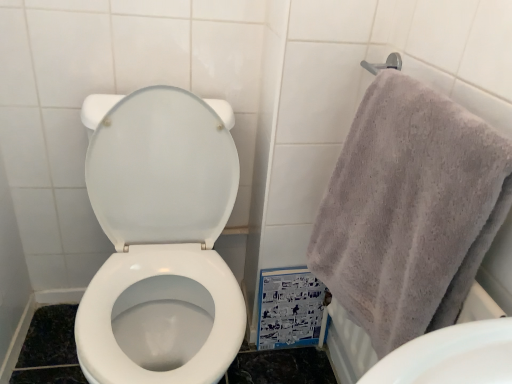
Question: Can you confirm if white glossy toilet at center is smaller than gray cotton towel at upper right?

Choices:
 (A) yes
 (B) no

Answer: (B)

Question: Does white glossy toilet at center appear on the left side of gray cotton towel at upper right?

Choices:
 (A) yes
 (B) no

Answer: (A)

Question: Is white glossy toilet at center looking in the opposite direction of gray cotton towel at upper right?

Choices:
 (A) no
 (B) yes

Answer: (A)

Question: Considering the relative sizes of white glossy toilet at center and gray cotton towel at upper right in the image provided, is white glossy toilet at center thinner than gray cotton towel at upper right?

Choices:
 (A) yes
 (B) no

Answer: (B)

Question: Considering the relative sizes of white glossy toilet at center and gray cotton towel at upper right in the image provided, is white glossy toilet at center shorter than gray cotton towel at upper right?

Choices:
 (A) no
 (B) yes

Answer: (A)

Question: Is white glossy toilet at center located outside gray cotton towel at upper right?

Choices:
 (A) no
 (B) yes

Answer: (B)

Question: Is gray cotton towel at upper right with white glossy toilet at center?

Choices:
 (A) no
 (B) yes

Answer: (A)

Question: From a real-world perspective, is gray cotton towel at upper right located higher than white glossy toilet at center?

Choices:
 (A) yes
 (B) no

Answer: (A)

Question: Does gray cotton towel at upper right appear on the right side of white glossy toilet at center?

Choices:
 (A) yes
 (B) no

Answer: (A)

Question: Are gray cotton towel at upper right and white glossy toilet at center located far from each other?

Choices:
 (A) no
 (B) yes

Answer: (A)

Question: Is gray cotton towel at upper right outside white glossy toilet at center?

Choices:
 (A) no
 (B) yes

Answer: (B)

Question: Does gray cotton towel at upper right have a lesser height compared to white glossy toilet at center?

Choices:
 (A) no
 (B) yes

Answer: (B)

Question: Is gray cotton towel at upper right wider or thinner than white glossy toilet at center?

Choices:
 (A) thin
 (B) wide

Answer: (A)